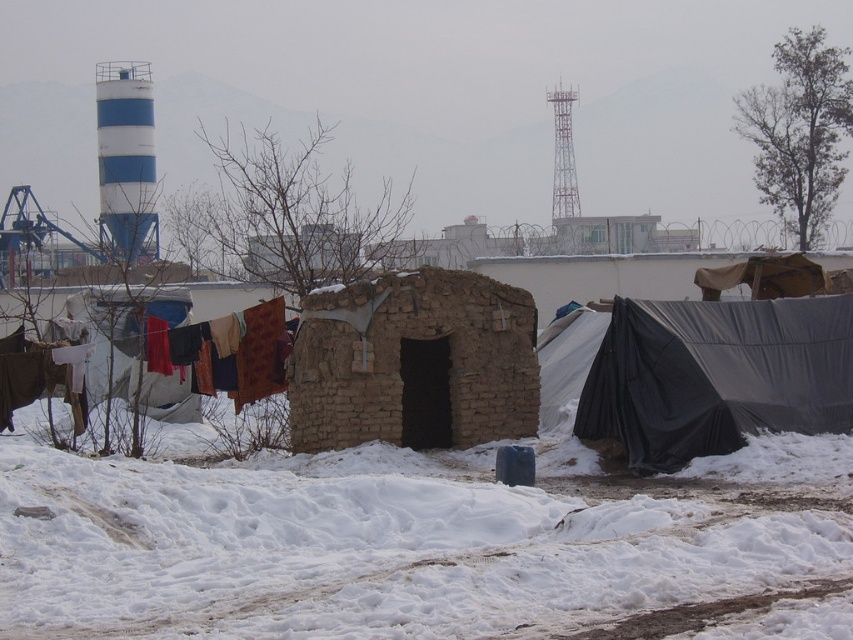
You are standing in the snowy area and want to walk to the brown mud hut at center. Which direction should you move relative to the white fluffy snow at center?

You should move away from the white fluffy snow at center towards the brown mud hut at center since the snow is in front of the hut, meaning the hut is behind the snow from your current position.

You are standing at the point marked by the coordinates point (x=366, y=550). Looking around, you see the small makeshift shelter constructed from mud bricks or similar material in the foreground and clothes hung out to dry on a line to the left of the shelter. Where are you relative to the shelter and the clothesline?

The point marked by the coordinates point (x=366, y=550) is located at the center of the image, which is where the white fluffy snow at center is located. Since the shelter is in the foreground and the clothesline is to the left of the shelter, you are positioned to the right of both the shelter and the clothesline.

You are planning to set up a tent in this snowy area. You have two options available from the image, the black tarpaulin tent at right and the multicolored fabric at left. Which one would provide taller shelter for your equipment?

The multicolored fabric at left is taller than the black tarpaulin tent at right, so it would provide taller shelter for your equipment.